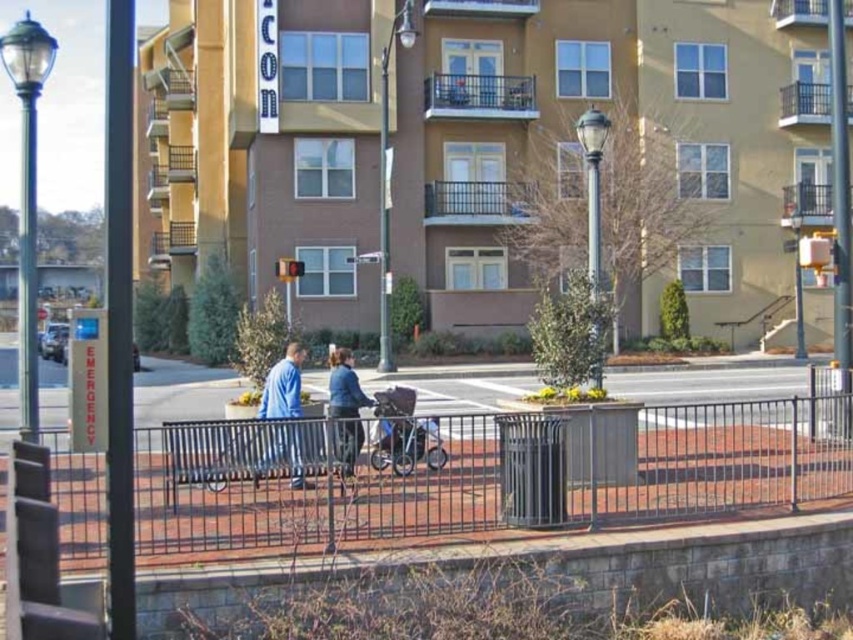
Who is positioned more to the right, green glass lamp post at left or metallic gray streetlight at center?

Positioned to the right is metallic gray streetlight at center.

The width and height of the screenshot is (853, 640). Describe the element at coordinates (27, 196) in the screenshot. I see `green glass lamp post at left` at that location.

This screenshot has width=853, height=640. Find the location of `green glass lamp post at left`. green glass lamp post at left is located at coordinates (27, 196).

Is point (292, 365) in front of point (434, 444)?

Yes, point (292, 365) is in front of point (434, 444).

Can you confirm if blue fabric jacket at center is wider than silver metallic stroller at center?

No, blue fabric jacket at center is not wider than silver metallic stroller at center.

Does point (299, 403) come closer to viewer compared to point (378, 451)?

Yes.

Identify the location of blue fabric jacket at center. This screenshot has width=853, height=640. (283, 387).

Can you confirm if green glass lamp post at left is thinner than silver metallic stroller at center?

No.

Can you confirm if green glass lamp post at left is smaller than silver metallic stroller at center?

Incorrect, green glass lamp post at left is not smaller in size than silver metallic stroller at center.

Does point (44, 72) come closer to viewer compared to point (431, 438)?

Yes, point (44, 72) is in front of point (431, 438).

Locate an element on the screen. This screenshot has width=853, height=640. green glass lamp post at left is located at coordinates (27, 196).